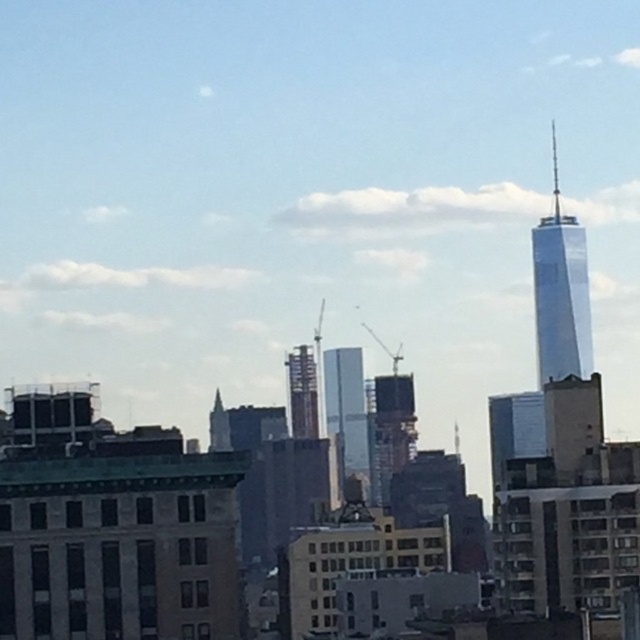
Can you confirm if white glass tower at upper right is thinner than glassy reflective skyscraper at center?

No, white glass tower at upper right is not thinner than glassy reflective skyscraper at center.

Is white glass tower at upper right to the left of glassy reflective skyscraper at center from the viewer's perspective?

Incorrect, white glass tower at upper right is not on the left side of glassy reflective skyscraper at center.

This screenshot has height=640, width=640. I want to click on white glass tower at upper right, so click(x=561, y=292).

Which of these two, white glass tower at upper right or metallic silver tower at center, stands taller?

Standing taller between the two is white glass tower at upper right.

Is point (540, 321) positioned behind point (310, 358)?

Yes.

Measure the distance between white glass tower at upper right and camera.

white glass tower at upper right and camera are 653.87 meters apart.

Identify the location of white glass tower at upper right. The image size is (640, 640). (561, 292).

Can you confirm if glassy reflective skyscraper at center is positioned to the right of metallic silver tower at center?

Correct, you'll find glassy reflective skyscraper at center to the right of metallic silver tower at center.

Who is taller, glassy reflective skyscraper at center or metallic silver tower at center?

glassy reflective skyscraper at center is taller.

Between point (358, 461) and point (305, 426), which one is positioned behind?

The point (358, 461) is more distant.

Locate an element on the screen. glassy reflective skyscraper at center is located at coordinates (346, 413).